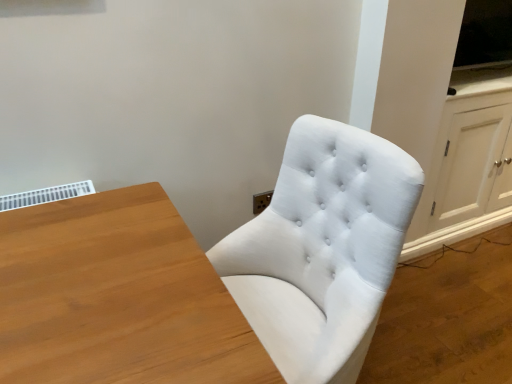
Question: Is the position of white fabric chair at center more distant than that of white wood dresser at right?

Choices:
 (A) yes
 (B) no

Answer: (B)

Question: From the image's perspective, does white fabric chair at center appear lower than white wood dresser at right?

Choices:
 (A) no
 (B) yes

Answer: (B)

Question: Is white fabric chair at center beside white wood dresser at right?

Choices:
 (A) no
 (B) yes

Answer: (A)

Question: From a real-world perspective, is white fabric chair at center on white wood dresser at right?

Choices:
 (A) yes
 (B) no

Answer: (A)

Question: Is white fabric chair at center thinner than white wood dresser at right?

Choices:
 (A) yes
 (B) no

Answer: (B)

Question: Is white fabric chair at center facing towards white wood dresser at right?

Choices:
 (A) no
 (B) yes

Answer: (A)

Question: Considering the relative positions of white wood dresser at right and white fabric chair at center in the image provided, is white wood dresser at right to the right of white fabric chair at center from the viewer's perspective?

Choices:
 (A) yes
 (B) no

Answer: (A)

Question: Are white wood dresser at right and white fabric chair at center far apart?

Choices:
 (A) yes
 (B) no

Answer: (B)

Question: Considering the relative sizes of white wood dresser at right and white fabric chair at center in the image provided, is white wood dresser at right taller than white fabric chair at center?

Choices:
 (A) yes
 (B) no

Answer: (B)

Question: Would you say white fabric chair at center is part of white wood dresser at right's contents?

Choices:
 (A) no
 (B) yes

Answer: (A)

Question: From the image's perspective, is white wood dresser at right below white fabric chair at center?

Choices:
 (A) no
 (B) yes

Answer: (A)

Question: Can you confirm if white wood dresser at right is shorter than white fabric chair at center?

Choices:
 (A) no
 (B) yes

Answer: (B)

Question: Considering the positions of white fabric chair at center and white wood dresser at right in the image, is white fabric chair at center taller or shorter than white wood dresser at right?

Choices:
 (A) short
 (B) tall

Answer: (B)